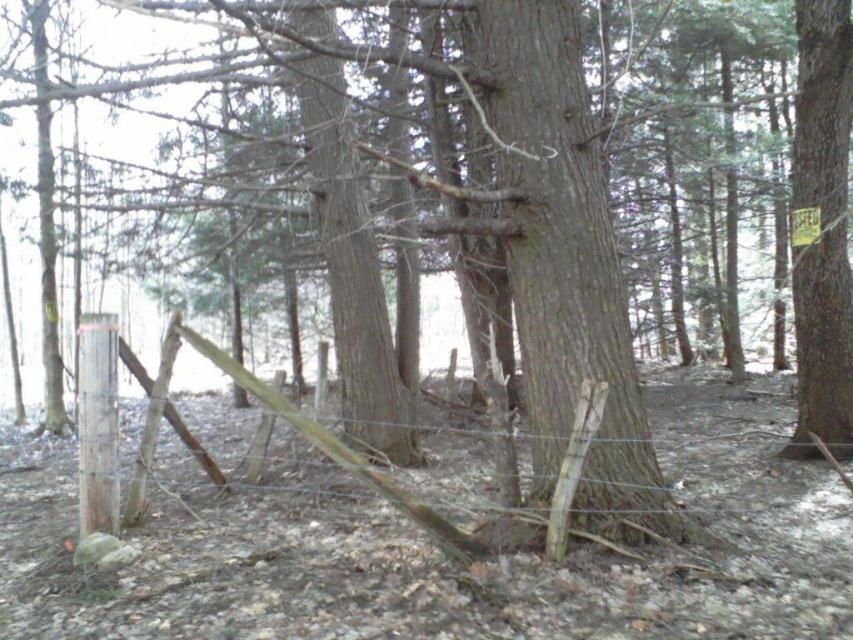
You are a park ranger trying to assess the distance between the smooth brown tree trunk at right and the wooden fence at center. According to the scene, how far apart are they?

The smooth brown tree trunk at right and the wooden fence at center are 3.80 meters apart.

You are a hiker navigating through the woods and want to determine the best path to avoid obstacles. You notice two points marked in the image. Which point is closer to you, point (813,168) or point (589,433)?

Point (813,168) is further to the viewer than point (589,433). Therefore, point (589,433) is closer to you.